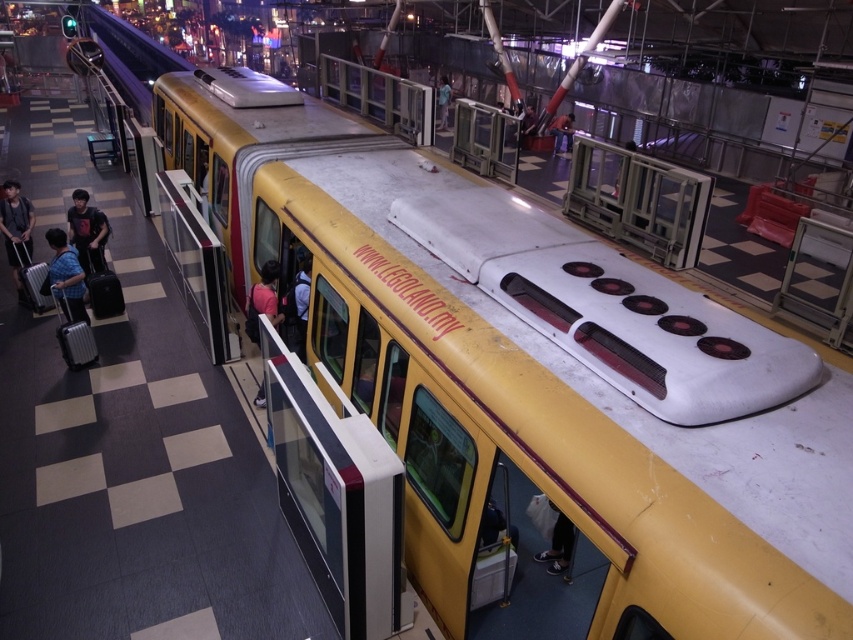
Between point (99, 266) and point (444, 86), which one is positioned in front?

Point (99, 266) is in front.

Who is positioned more to the left, dark gray fabric shirt at left or light blue fabric shirt at center?

dark gray fabric shirt at left is more to the left.

Who is more forward, (x=96, y=209) or (x=447, y=104)?

Point (x=96, y=209) is more forward.

Where is `dark gray fabric shirt at left`? dark gray fabric shirt at left is located at coordinates (86, 232).

From the picture: Can you confirm if matte black suitcase at left is wider than pink fabric at center?

No, matte black suitcase at left is not wider than pink fabric at center.

Does matte black suitcase at left appear under pink fabric at center?

No.

Between point (4, 188) and point (264, 262), which one is positioned in front?

Point (264, 262) is more forward.

Where is `matte black suitcase at left`? matte black suitcase at left is located at coordinates (16, 230).

Is matte black suitcase at left shorter than dark gray fabric shirt at left?

No, matte black suitcase at left is not shorter than dark gray fabric shirt at left.

Who is higher up, matte black suitcase at left or dark gray fabric shirt at left?

Positioned higher is dark gray fabric shirt at left.

Find the location of a particular element. This screenshot has width=853, height=640. matte black suitcase at left is located at coordinates (16, 230).